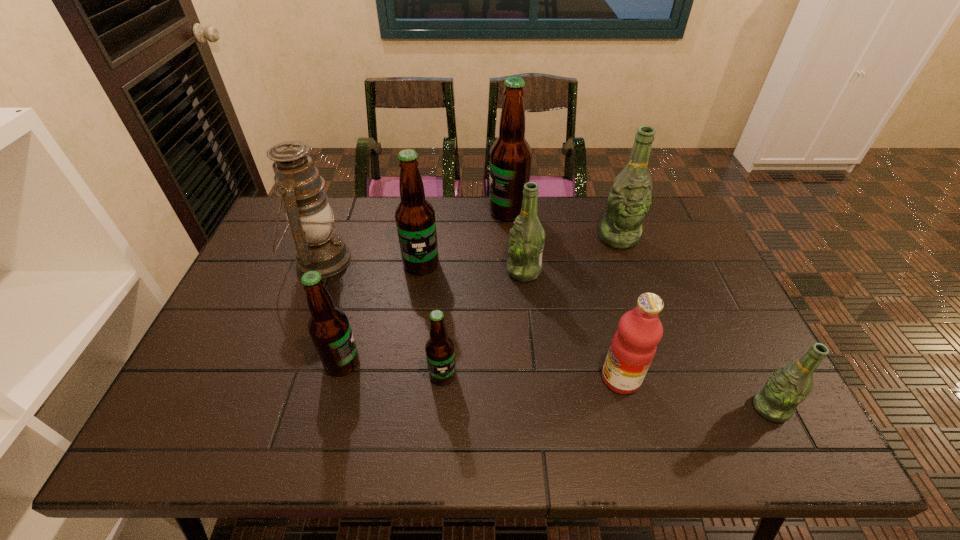
In the image, there is a desktop. Where is `free region at the near edge`? free region at the near edge is located at coordinates (348, 435).

You are a GUI agent. You are given a task and a screenshot of the screen. Output one action in this format:
    pyautogui.click(x=<x>, y=<y>)
    Task: Click on the vacant area at the left edge
    This screenshot has height=540, width=960.
    Given the screenshot: What is the action you would take?
    pyautogui.click(x=263, y=316)

The width and height of the screenshot is (960, 540). I want to click on vacant space at the right edge of the desktop, so click(696, 276).

Locate an element on the screen. vacant area at the far right corner of the desktop is located at coordinates (662, 205).

At what (x,y) coordinates should I click in order to perform the action: click on free spot between the pink fruit juice and the leftmost brown beer bottle. Please return your answer as a coordinate pair (x, y). Looking at the image, I should click on (482, 370).

The width and height of the screenshot is (960, 540). In order to click on empty space that is in between the second biggest brown beer bottle and the fruit juice in this screenshot , I will do `click(521, 321)`.

The height and width of the screenshot is (540, 960). Find the location of `vacant space that's between the leftmost beer bottle and the nearest green beer bottle`. vacant space that's between the leftmost beer bottle and the nearest green beer bottle is located at coordinates (556, 385).

Locate an element on the screen. free spot between the leftmost green beer bottle and the pink fruit juice is located at coordinates click(572, 325).

This screenshot has height=540, width=960. I want to click on empty space between the leftmost green beer bottle and the pink fruit juice, so click(572, 325).

At what (x,y) coordinates should I click in order to perform the action: click on vacant area between the farthest object and the third nearest brown beer bottle. Please return your answer as a coordinate pair (x, y). Looking at the image, I should click on (465, 238).